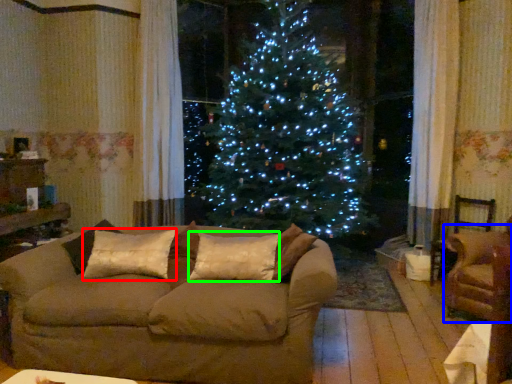
Question: Which object is positioned farthest from pillow (highlighted by a red box)? Select from armchair (highlighted by a blue box) and pillow (highlighted by a green box).

Choices:
 (A) armchair
 (B) pillow

Answer: (A)